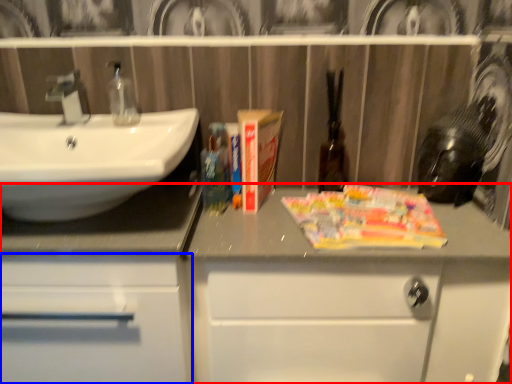
Question: Which point is closer to the camera, bathroom cabinet (highlighted by a red box) or bathroom cabinet (highlighted by a blue box)?

Choices:
 (A) bathroom cabinet
 (B) bathroom cabinet

Answer: (B)